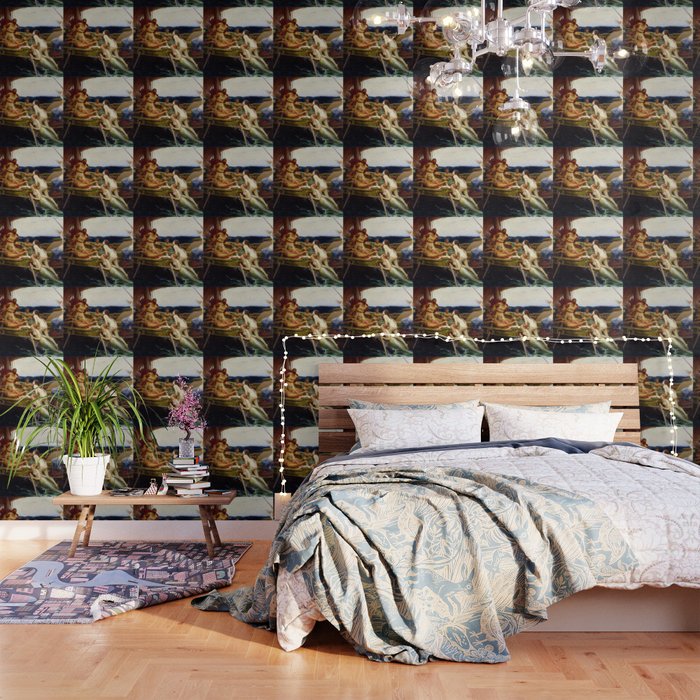
Where is `bedsheet`? This screenshot has width=700, height=700. bedsheet is located at coordinates (516, 533).